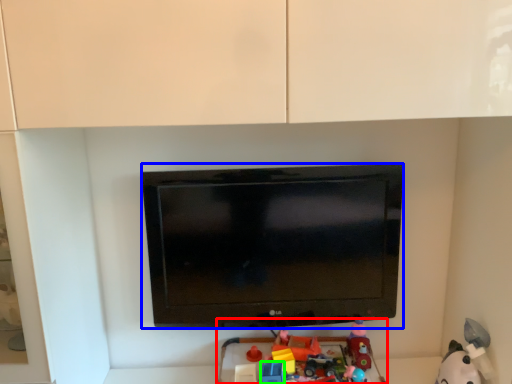
Question: Considering the real-world distances, which object is closest to toy (highlighted by a red box)? television (highlighted by a blue box) or toy (highlighted by a green box).

Choices:
 (A) television
 (B) toy

Answer: (B)